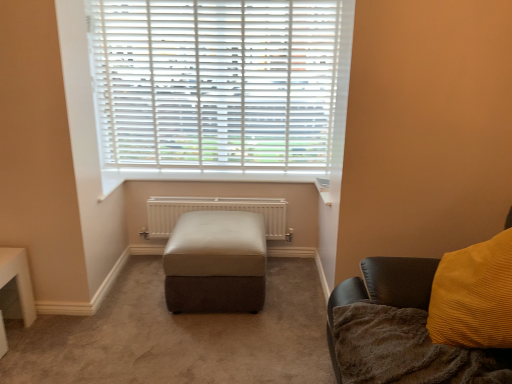
Find the location of a particular element. unoccupied region to the right of leather ottoman at center is located at coordinates (294, 302).